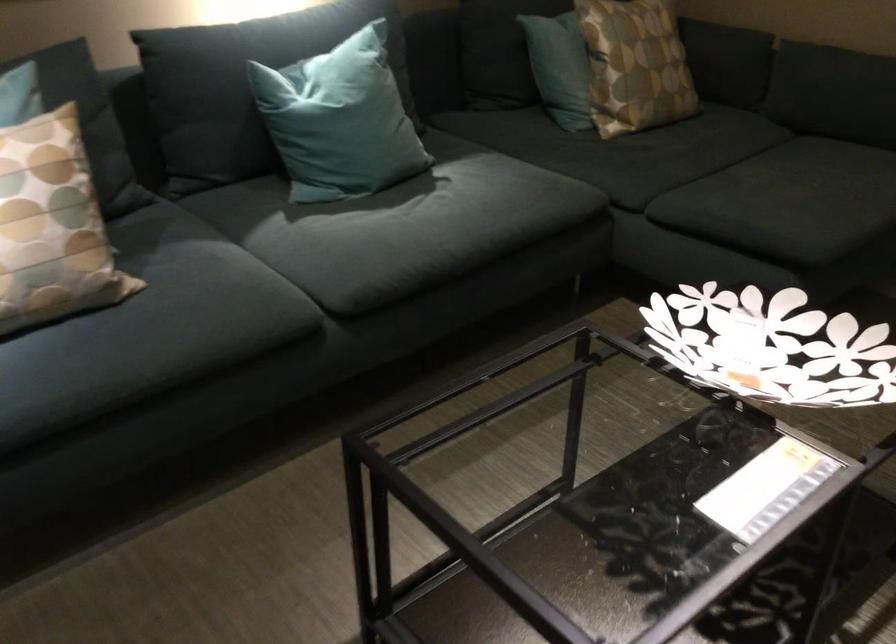
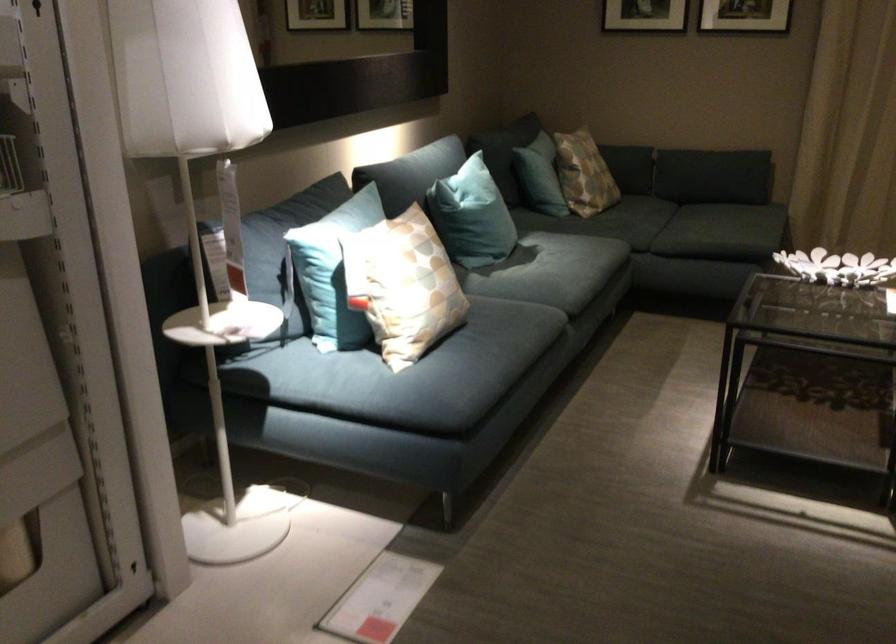
Find the pixel in the second image that matches point (307, 124) in the first image.

(471, 216)